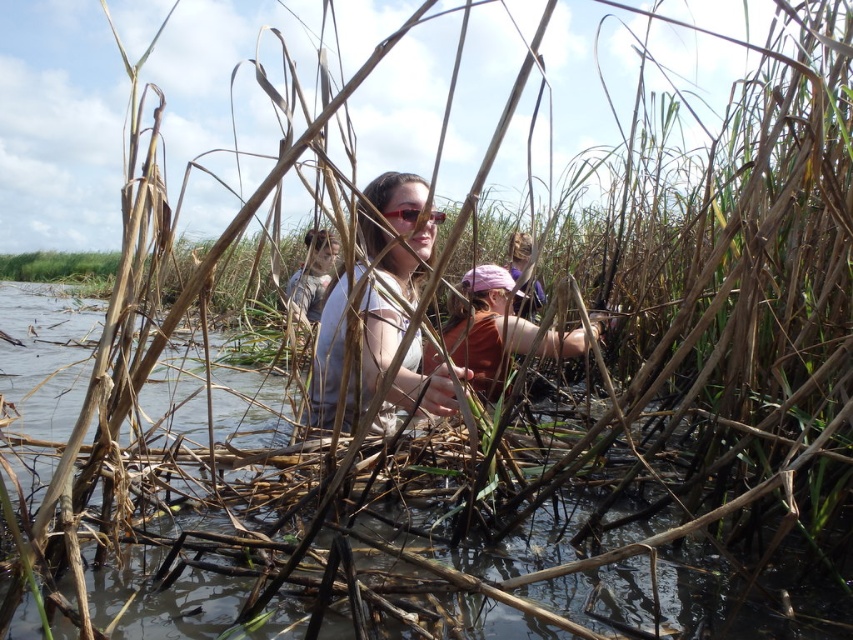
Between matte white shirt at center and sunglasses at center, which one is positioned higher?

sunglasses at center

In order to click on matte white shirt at center in this screenshot , I will do `click(396, 230)`.

Which is behind, point (418, 284) or point (421, 214)?

The point (418, 284) is behind.

The height and width of the screenshot is (640, 853). In order to click on matte white shirt at center in this screenshot , I will do `click(396, 230)`.

Which is above, matte white shirt at center or matte orange shirt at center?

matte orange shirt at center is above.

Which is behind, point (335, 364) or point (579, 348)?

The point (579, 348) is more distant.

The image size is (853, 640). Identify the location of matte white shirt at center. (396, 230).

Which is in front, point (514, 323) or point (421, 211)?

Point (421, 211) is more forward.

This screenshot has width=853, height=640. Identify the location of matte orange shirt at center. (485, 328).